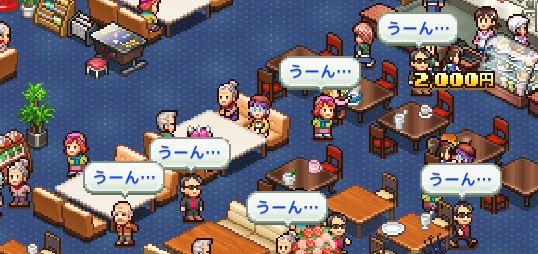
Identify the location of armchair. (73, 226).